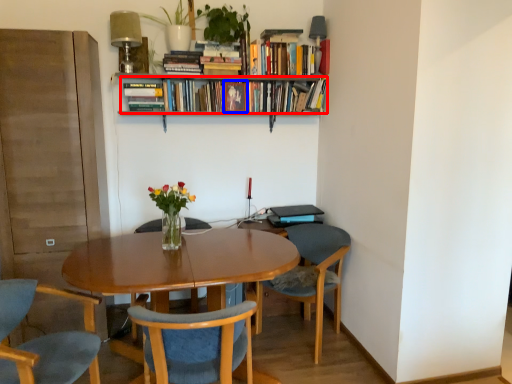
Question: Which point is closer to the camera, book (highlighted by a red box) or book (highlighted by a blue box)?

Choices:
 (A) book
 (B) book

Answer: (A)